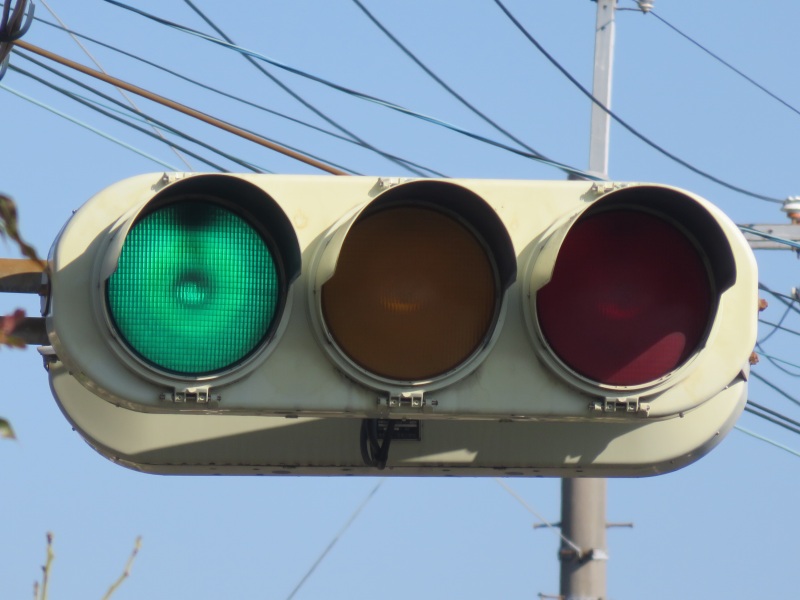
This screenshot has height=600, width=800. I want to click on yellow light, so click(377, 291).